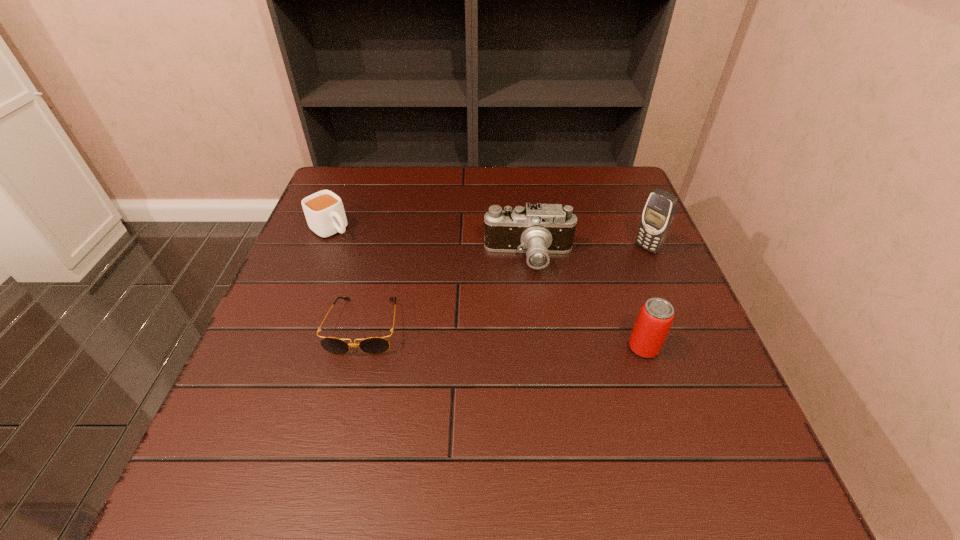
Identify the location of unoccupied position between the tallest object and the fourth object from left to right. The width and height of the screenshot is (960, 540). coord(645,298).

You are a GUI agent. You are given a task and a screenshot of the screen. Output one action in this format:
    pyautogui.click(x=<x>, y=<y>)
    Task: Click on the free space between the camera and the fourth tallest object
    
    Given the screenshot: What is the action you would take?
    pyautogui.click(x=430, y=244)

Where is `free spot between the sunglasses and the cup`? The width and height of the screenshot is (960, 540). free spot between the sunglasses and the cup is located at coordinates (348, 278).

Identify the location of free space between the second shortest object and the beer can. (488, 288).

Where is `vacant space that is in between the tallest object and the camera`? This screenshot has width=960, height=540. vacant space that is in between the tallest object and the camera is located at coordinates (588, 253).

At what (x,y) coordinates should I click in order to perform the action: click on free spot between the tallest object and the third object from left to right. Please return your answer as a coordinate pair (x, y). Image resolution: width=960 pixels, height=540 pixels. Looking at the image, I should click on (588, 253).

You are a GUI agent. You are given a task and a screenshot of the screen. Output one action in this format:
    pyautogui.click(x=<x>, y=<y>)
    Task: Click on the unoccupied area between the camera and the fourth object from left to right
    This screenshot has height=540, width=960.
    Given the screenshot: What is the action you would take?
    pyautogui.click(x=587, y=303)

At what (x,y) coordinates should I click in order to perform the action: click on empty location between the fourth tallest object and the second object from left to right. Please return your answer as a coordinate pair (x, y). The image size is (960, 540). Looking at the image, I should click on (348, 278).

Identify which object is the nearest to the cellular telephone. Please provide its 2D coordinates. Your answer should be formatted as a tuple, i.e. [(x, y)], where the tuple contains the x and y coordinates of a point satisfying the conditions above.

[(538, 230)]

Select which object appears as the closest to the second object from right to left. Please provide its 2D coordinates. Your answer should be formatted as a tuple, i.e. [(x, y)], where the tuple contains the x and y coordinates of a point satisfying the conditions above.

[(538, 230)]